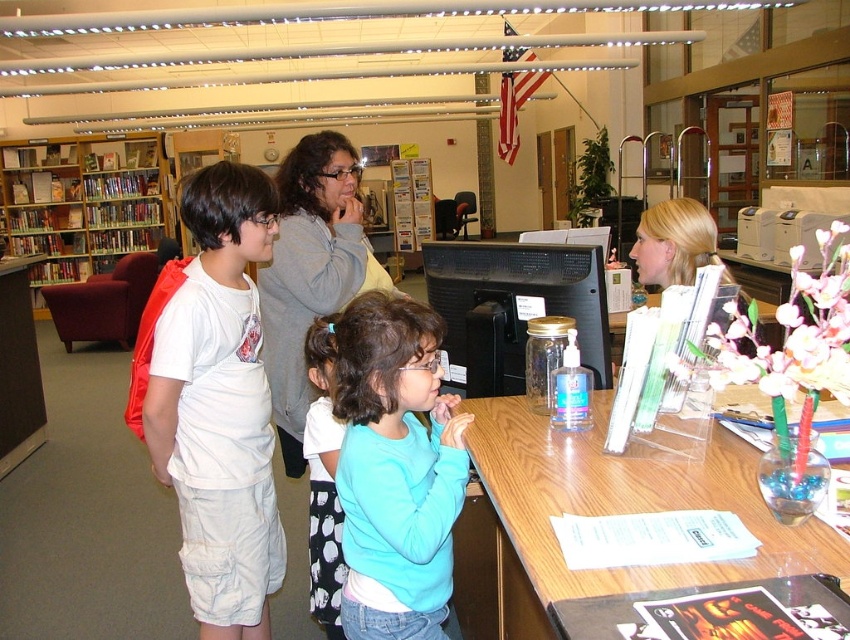
You are a delivery person who needs to place a small package between the light blue sweater at center and the blue fabric skirt at lower center. Can you fit the package in the space between them?

The distance between the light blue sweater at center and the blue fabric skirt at lower center is 31.60 centimeters, so yes, the package can be placed there as the space is sufficient.

You are a parent trying to locate your child in the library. You remember your child was wearing a white cotton shirt at left and a blue fabric skirt at lower center. Based on the scene description, which clothing item would be higher up when looking at them from the front?

The white cotton shirt at left is taller than blue fabric skirt at lower center, so the white cotton shirt at left would be higher up when looking at them from the front.